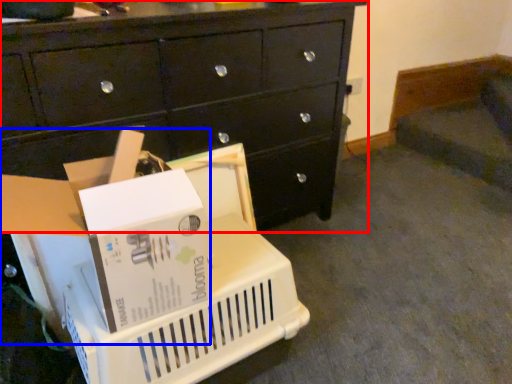
Question: Which point is further to the camera, chest of drawers (highlighted by a red box) or storage box (highlighted by a blue box)?

Choices:
 (A) chest of drawers
 (B) storage box

Answer: (A)